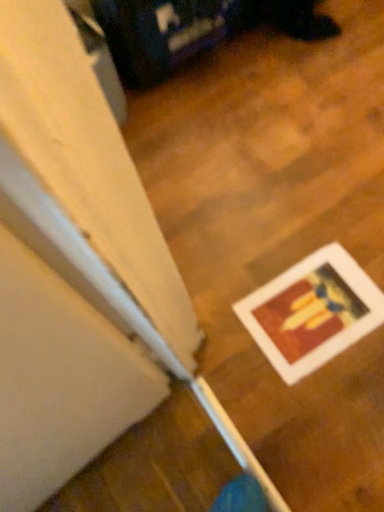
Locate an element on the screen. This screenshot has height=512, width=384. free point above wooden floor at lower right (from a real-world perspective) is located at coordinates (263, 161).